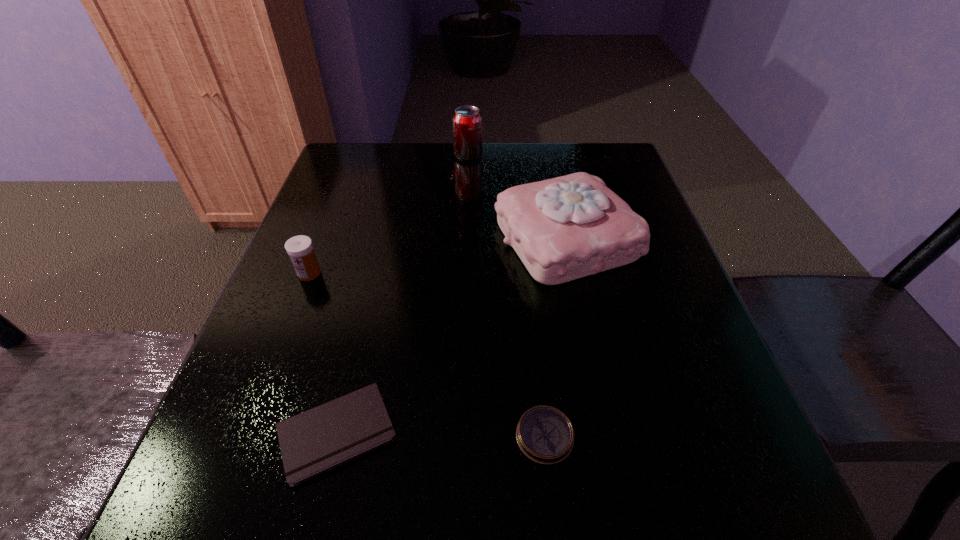
This screenshot has height=540, width=960. Find the location of `the farthest object`. the farthest object is located at coordinates point(467,120).

Where is `the third object from right to left`? the third object from right to left is located at coordinates (467, 120).

The image size is (960, 540). Identify the location of cake. (565, 228).

Image resolution: width=960 pixels, height=540 pixels. What are the coordinates of `the third shortest object` in the screenshot? It's located at (300, 249).

At what (x,y) coordinates should I click in order to perform the action: click on medicine. Please return your answer as a coordinate pair (x, y). The height and width of the screenshot is (540, 960). Looking at the image, I should click on (300, 249).

The width and height of the screenshot is (960, 540). What are the coordinates of `compass` in the screenshot? It's located at (545, 435).

Image resolution: width=960 pixels, height=540 pixels. In order to click on the fourth object from right to left in this screenshot , I will do click(318, 440).

Where is `free space located on the left of the soda can`? The height and width of the screenshot is (540, 960). free space located on the left of the soda can is located at coordinates (396, 156).

Locate an element on the screen. The width and height of the screenshot is (960, 540). vacant area situated on the left of the cake is located at coordinates (360, 239).

Where is `free space located on the front of the medicine`? This screenshot has height=540, width=960. free space located on the front of the medicine is located at coordinates (260, 398).